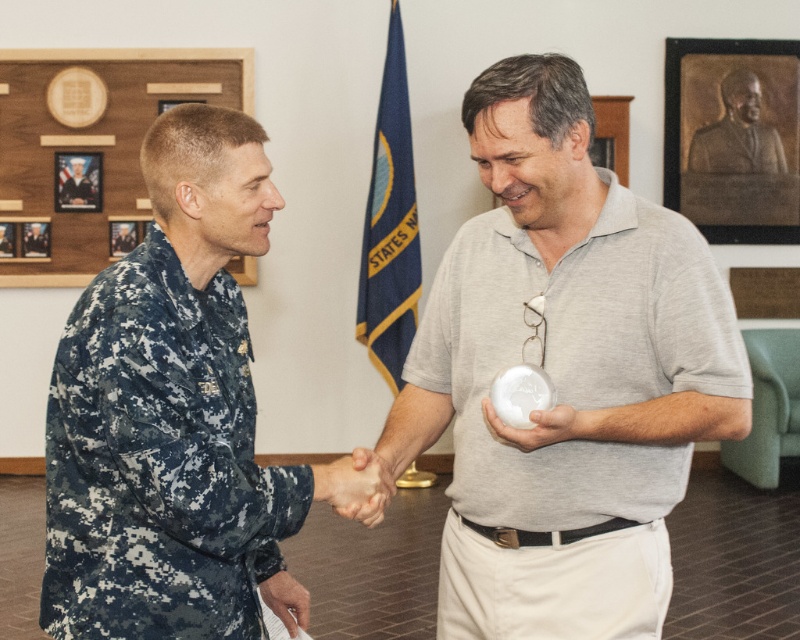
You are a photographer standing in front of the scene. You want to take a photo of the digital camouflage uniform at left and the white glossy sphere at center. Which object should you focus on first to ensure both are in focus?

You should focus on the digital camouflage uniform at left first because it is closer to you than the white glossy sphere at center, which is further away. By focusing on the closer object, the depth of field may help keep both in focus.

From the picture: You are a photographer at the event and want to capture a photo where both the digital camouflage uniform at left and the camouflage uniform at center are clearly visible. Given their height difference, which person should you position closer to the camera to ensure both are equally visible in the photo?

The digital camouflage uniform at left is much taller than the camouflage uniform at center, so positioning the shorter camouflage uniform at center closer to the camera will help balance their visibility in the photo.

You are a photographer at the event and need to capture a photo of the digital camouflage uniform at left and the camouflage uniform at center. According to the scene description, which one is positioned more to the right?

The digital camouflage uniform at left is positioned more to the right compared to the camouflage uniform at center.